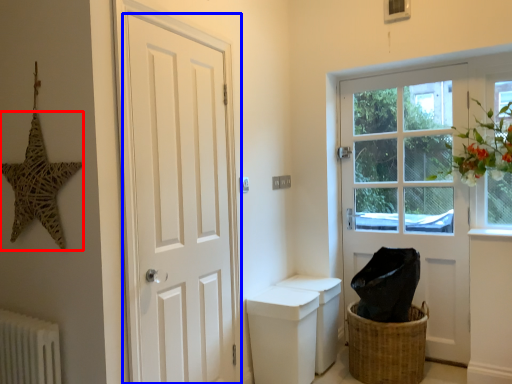
Question: Which object appears closest to the camera in this image, star (highlighted by a red box) or door (highlighted by a blue box)?

Choices:
 (A) star
 (B) door

Answer: (A)